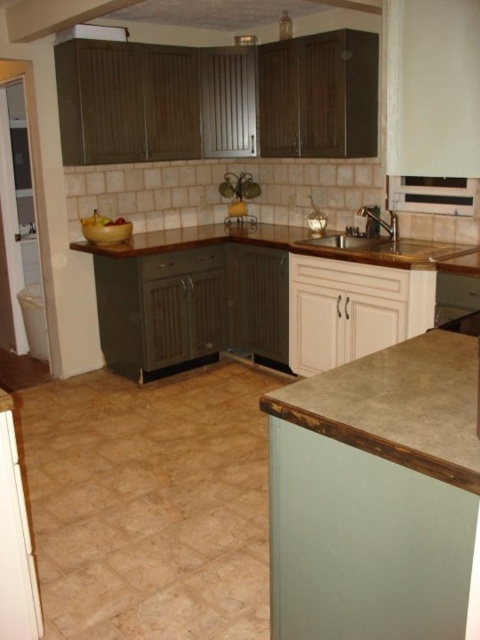
Can you confirm if concrete textured countertop at lower right is positioned to the right of brown laminate counter top at center?

Correct, you'll find concrete textured countertop at lower right to the right of brown laminate counter top at center.

Can you confirm if concrete textured countertop at lower right is positioned below brown laminate counter top at center?

Correct, concrete textured countertop at lower right is located below brown laminate counter top at center.

Does point (384, 456) come in front of point (456, 243)?

Yes, it is in front of point (456, 243).

Image resolution: width=480 pixels, height=640 pixels. In order to click on concrete textured countertop at lower right in this screenshot , I will do `click(397, 404)`.

Does brown laminate counter top at center appear over metallic sink at center?

Indeed, brown laminate counter top at center is positioned over metallic sink at center.

Is brown laminate counter top at center positioned at the back of metallic sink at center?

No, it is in front of metallic sink at center.

Does point (379, 237) come farther from viewer compared to point (391, 266)?

Yes, it is.

What are the coordinates of `brown laminate counter top at center` in the screenshot? It's located at (298, 246).

Which of these two, concrete textured countertop at lower right or metallic sink at center, stands taller?

metallic sink at center is taller.

Does concrete textured countertop at lower right appear on the left side of metallic sink at center?

Correct, you'll find concrete textured countertop at lower right to the left of metallic sink at center.

The width and height of the screenshot is (480, 640). What do you see at coordinates (397, 404) in the screenshot?
I see `concrete textured countertop at lower right` at bounding box center [397, 404].

Image resolution: width=480 pixels, height=640 pixels. Find the location of `concrete textured countertop at lower right`. concrete textured countertop at lower right is located at coordinates (397, 404).